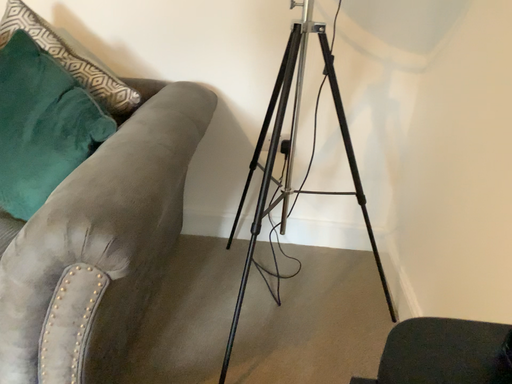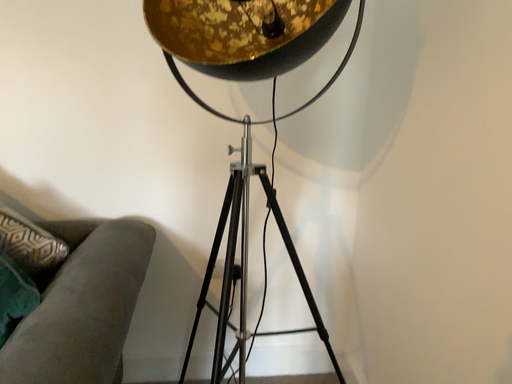
Question: Which way did the camera rotate in the video?

Choices:
 (A) rotated left
 (B) rotated right

Answer: (B)